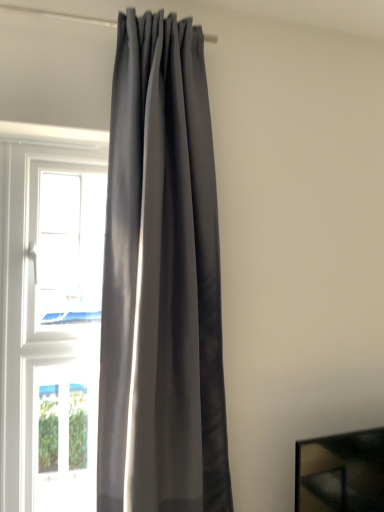
Question: Based on their sizes in the image, would you say white glossy window at left, which ranks as the first window in top-to-bottom order, is bigger or smaller than matte gray curtain at center?

Choices:
 (A) big
 (B) small

Answer: (B)

Question: Looking at their shapes, would you say white glossy window at left, the second window ordered from the bottom, is wider or thinner than matte gray curtain at center?

Choices:
 (A) thin
 (B) wide

Answer: (A)

Question: Which object is positioned farthest from the matte gray curtain at center?

Choices:
 (A) white glossy window at left, the second window ordered from the bottom
 (B) transparent glass window at left, marked as the 1th window in a bottom-to-top arrangement

Answer: (B)

Question: Which object is the closest to the transparent glass window at left, marked as the 1th window in a bottom-to-top arrangement?

Choices:
 (A) white glossy window at left, which ranks as the first window in top-to-bottom order
 (B) matte gray curtain at center

Answer: (B)